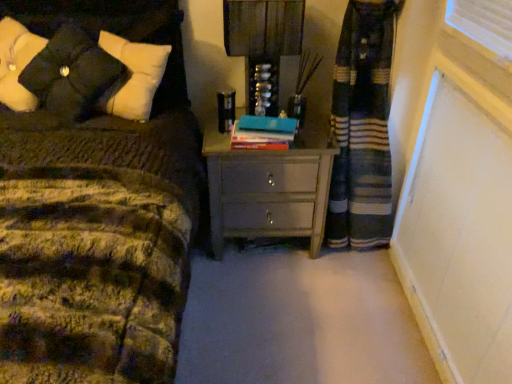
Question: Could you tell me if hardcover book at center is facing matte gray chest of drawers at center?

Choices:
 (A) yes
 (B) no

Answer: (B)

Question: From the image's perspective, would you say hardcover book at center is positioned over matte gray chest of drawers at center?

Choices:
 (A) yes
 (B) no

Answer: (A)

Question: Is hardcover book at center to the left of matte gray chest of drawers at center from the viewer's perspective?

Choices:
 (A) yes
 (B) no

Answer: (A)

Question: Is hardcover book at center wider than matte gray chest of drawers at center?

Choices:
 (A) no
 (B) yes

Answer: (A)

Question: Can you confirm if hardcover book at center is taller than matte gray chest of drawers at center?

Choices:
 (A) yes
 (B) no

Answer: (B)

Question: Considering the relative sizes of hardcover book at center and matte gray chest of drawers at center in the image provided, is hardcover book at center shorter than matte gray chest of drawers at center?

Choices:
 (A) no
 (B) yes

Answer: (B)

Question: Can you confirm if hardcover book at center is bigger than black matte pillow at upper left?

Choices:
 (A) yes
 (B) no

Answer: (B)

Question: Can black matte pillow at upper left be found inside hardcover book at center?

Choices:
 (A) yes
 (B) no

Answer: (B)

Question: Can you confirm if hardcover book at center is positioned to the left of black matte pillow at upper left?

Choices:
 (A) no
 (B) yes

Answer: (A)

Question: Can you confirm if hardcover book at center is taller than black matte pillow at upper left?

Choices:
 (A) no
 (B) yes

Answer: (A)

Question: Is hardcover book at center facing away from black matte pillow at upper left?

Choices:
 (A) no
 (B) yes

Answer: (A)

Question: From the image's perspective, would you say hardcover book at center is shown under black matte pillow at upper left?

Choices:
 (A) no
 (B) yes

Answer: (B)

Question: Does matte black lampshade at upper center come behind hardcover book at center?

Choices:
 (A) yes
 (B) no

Answer: (B)